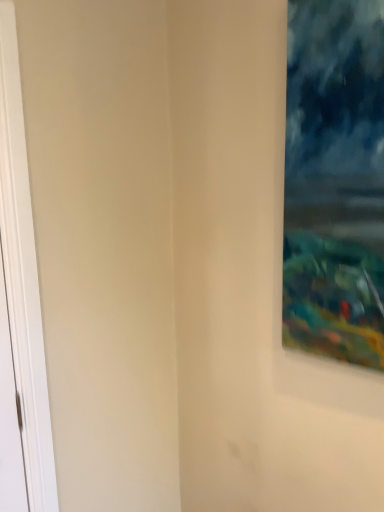
What do you see at coordinates (23, 277) in the screenshot? I see `white glossy screen door at left` at bounding box center [23, 277].

What are the coordinates of `white glossy screen door at left` in the screenshot? It's located at (23, 277).

Where is `white glossy screen door at left`? Image resolution: width=384 pixels, height=512 pixels. white glossy screen door at left is located at coordinates click(x=23, y=277).